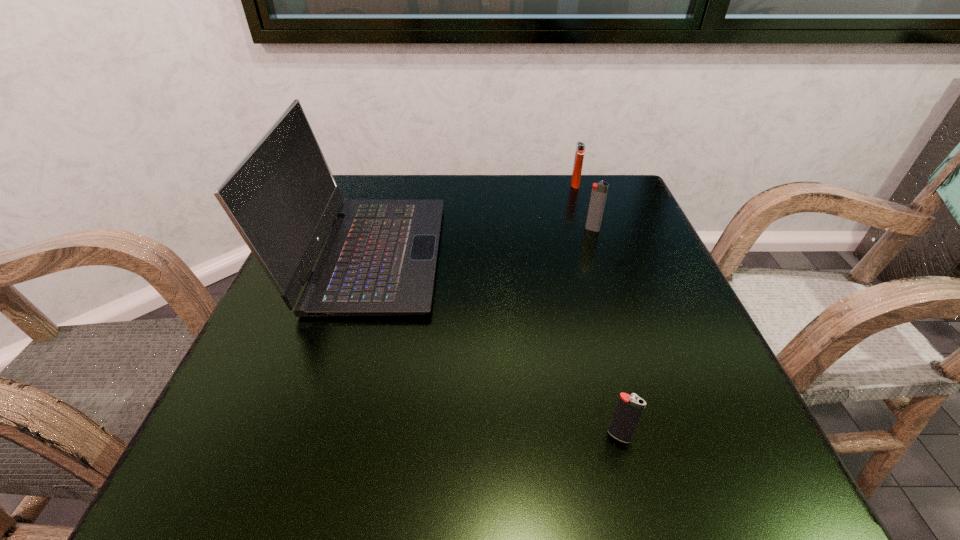
Image resolution: width=960 pixels, height=540 pixels. I want to click on laptop computer that is at the far edge, so click(379, 259).

Locate an element on the screen. Image resolution: width=960 pixels, height=540 pixels. object located at the near edge is located at coordinates (629, 408).

This screenshot has height=540, width=960. What are the coordinates of `object present at the left edge` in the screenshot? It's located at (379, 259).

Where is `object at the far left corner`? Image resolution: width=960 pixels, height=540 pixels. object at the far left corner is located at coordinates (379, 259).

Locate an element on the screen. This screenshot has height=540, width=960. free space at the far edge of the desktop is located at coordinates (472, 187).

Identify the location of vacant area at the near edge of the desktop. This screenshot has width=960, height=540. (505, 440).

Where is `vacant space at the left edge of the desktop`? vacant space at the left edge of the desktop is located at coordinates (322, 370).

Where is `vacant space at the right edge`? The height and width of the screenshot is (540, 960). vacant space at the right edge is located at coordinates (673, 312).

Identify the location of free spot at the far left corner of the desktop. (362, 188).

In the image, there is a desktop. Identify the location of blank space at the far right corner. (583, 192).